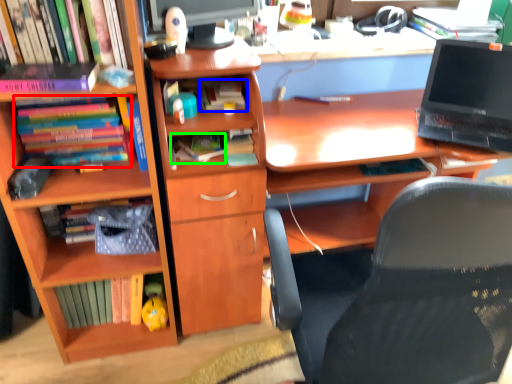
Question: Based on their relative distances, which object is farther from book (highlighted by a red box)? Choose from book (highlighted by a blue box) and book (highlighted by a green box).

Choices:
 (A) book
 (B) book

Answer: (A)